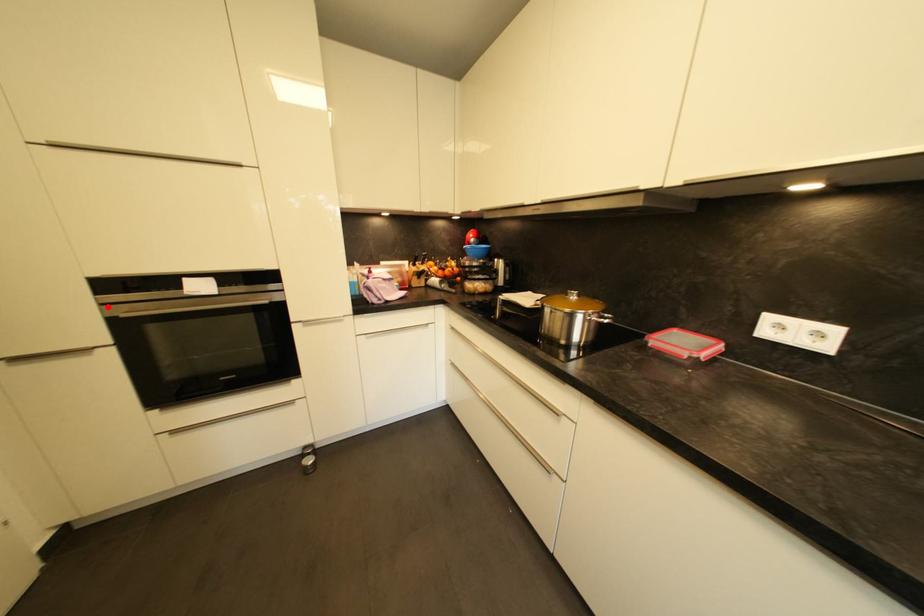
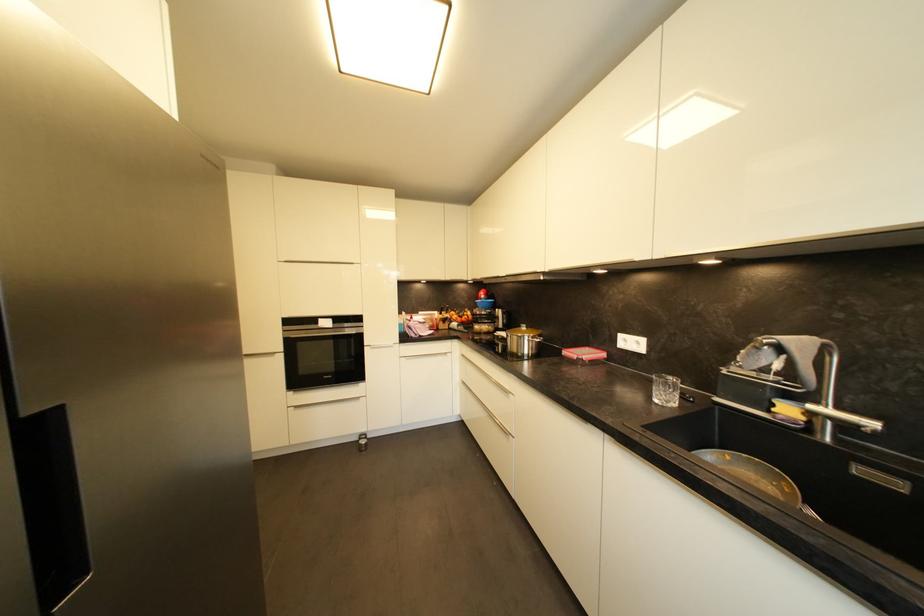
Find the pixel in the second image that matches the highlighted location in the first image.

(289, 333)